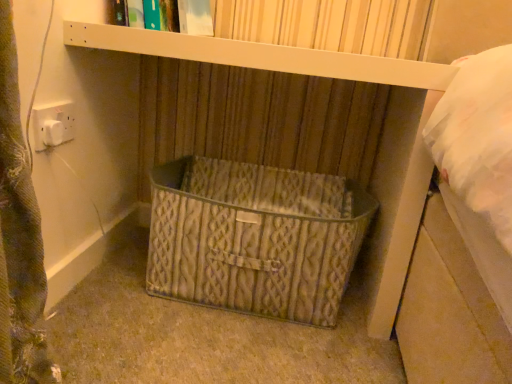
Question: Is rustic metal basket at center surrounding hardcover book at upper center?

Choices:
 (A) yes
 (B) no

Answer: (B)

Question: From a real-world perspective, is rustic metal basket at center on hardcover book at upper center?

Choices:
 (A) yes
 (B) no

Answer: (B)

Question: Is hardcover book at upper center at the back of rustic metal basket at center?

Choices:
 (A) yes
 (B) no

Answer: (B)

Question: Is rustic metal basket at center far away from hardcover book at upper center?

Choices:
 (A) no
 (B) yes

Answer: (A)

Question: Considering the relative sizes of rustic metal basket at center and hardcover book at upper center in the image provided, is rustic metal basket at center thinner than hardcover book at upper center?

Choices:
 (A) yes
 (B) no

Answer: (B)

Question: Does rustic metal basket at center turn towards hardcover book at upper center?

Choices:
 (A) no
 (B) yes

Answer: (A)

Question: Does hardcover book at upper center turn towards rustic metal basket at center?

Choices:
 (A) yes
 (B) no

Answer: (B)

Question: Can you confirm if hardcover book at upper center is positioned to the right of rustic metal basket at center?

Choices:
 (A) yes
 (B) no

Answer: (B)

Question: Is hardcover book at upper center not close to rustic metal basket at center?

Choices:
 (A) no
 (B) yes

Answer: (A)

Question: Does hardcover book at upper center lie behind rustic metal basket at center?

Choices:
 (A) yes
 (B) no

Answer: (A)

Question: Can you confirm if hardcover book at upper center is wider than rustic metal basket at center?

Choices:
 (A) no
 (B) yes

Answer: (A)

Question: Does hardcover book at upper center have a smaller size compared to rustic metal basket at center?

Choices:
 (A) no
 (B) yes

Answer: (B)

Question: From their relative heights in the image, would you say rustic metal basket at center is taller or shorter than hardcover book at upper center?

Choices:
 (A) tall
 (B) short

Answer: (A)